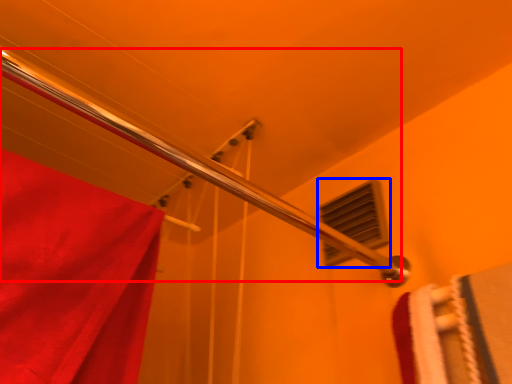
Question: Which point is closer to the camera, shower (highlighted by a red box) or window (highlighted by a blue box)?

Choices:
 (A) shower
 (B) window

Answer: (A)